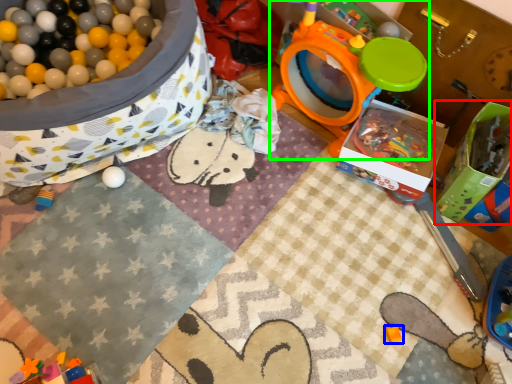
Question: Considering the real-world distances, which object is farthest from box (highlighted by a red box)? toy (highlighted by a blue box) or toy (highlighted by a green box)?

Choices:
 (A) toy
 (B) toy

Answer: (A)